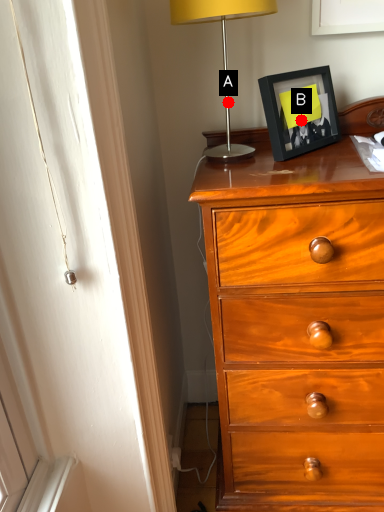
Question: Two points are circled on the image, labeled by A and B beside each circle. Among these points, which one is nearest to the camera?

Choices:
 (A) A is closer
 (B) B is closer

Answer: (B)